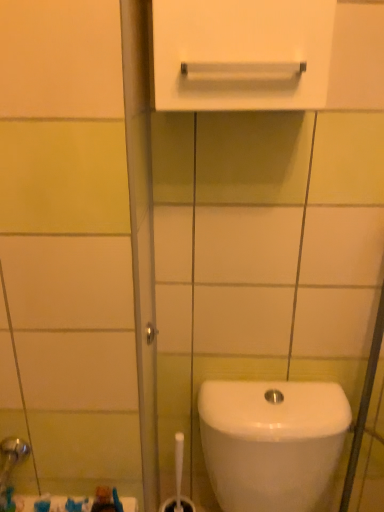
What do you see at coordinates (178, 482) in the screenshot? I see `white plastic brush at lower center` at bounding box center [178, 482].

Image resolution: width=384 pixels, height=512 pixels. I want to click on white glossy towel bar at upper center, so click(x=241, y=54).

Does point (322, 414) come behind point (293, 85)?

Yes.

Is white glossy toilet at lower right inside the boundaries of white glossy towel bar at upper center, or outside?

The correct answer is: outside.

From the image's perspective, does white glossy toilet at lower right appear higher than white glossy towel bar at upper center?

Actually, white glossy toilet at lower right appears below white glossy towel bar at upper center in the image.

Is white glossy toilet at lower right wider than white glossy towel bar at upper center?

Yes.

From the picture: From the image's perspective, is white glossy toilet at lower right under white plastic brush at lower center?

No, from the image's perspective, white glossy toilet at lower right is not beneath white plastic brush at lower center.

Between point (217, 420) and point (174, 499), which one is positioned behind?

The point (174, 499) is farther from the camera.

From the picture: Can you confirm if white glossy toilet at lower right is positioned to the right of white plastic brush at lower center?

Correct, you'll find white glossy toilet at lower right to the right of white plastic brush at lower center.

From a real-world perspective, which is physically below, white glossy toilet at lower right or white plastic brush at lower center?

white plastic brush at lower center.

How many degrees apart are the facing directions of white glossy towel bar at upper center and white glossy toilet at lower right?

They differ by 1.14 degrees in their facing directions.

From the image's perspective, which is below, white glossy towel bar at upper center or white glossy toilet at lower right?

white glossy toilet at lower right is shown below in the image.

Which object is thinner, white glossy towel bar at upper center or white glossy toilet at lower right?

With smaller width is white glossy towel bar at upper center.

Could you tell me if white plastic brush at lower center is turned towards white glossy toilet at lower right?

No.

Is white plastic brush at lower center shorter than white glossy toilet at lower right?

Yes.

Can you tell me how much white plastic brush at lower center and white glossy toilet at lower right differ in facing direction?

5.79e-06 degrees.

Which point is more distant from viewer, (168, 502) or (326, 387)?

Point (168, 502)

How different are the orientations of white plastic brush at lower center and white glossy towel bar at upper center in degrees?

1.14 degrees separate the facing orientations of white plastic brush at lower center and white glossy towel bar at upper center.

Does point (164, 511) lie behind point (217, 69)?

Yes.

Does white plastic brush at lower center have a greater width compared to white glossy towel bar at upper center?

No, white plastic brush at lower center is not wider than white glossy towel bar at upper center.

This screenshot has width=384, height=512. What are the coordinates of `medicine cabinet above the white plastic brush at lower center (from a real-world perspective)` in the screenshot? It's located at (241, 54).

Could you tell me if white glossy towel bar at upper center is turned towards white plastic brush at lower center?

No, white glossy towel bar at upper center is not turned towards white plastic brush at lower center.

From the image's perspective, between white glossy towel bar at upper center and white plastic brush at lower center, which one is located above?

white glossy towel bar at upper center.

Is point (224, 46) less distant than point (179, 434)?

Yes, point (224, 46) is closer to viewer.

From a real-world perspective, is white glossy towel bar at upper center on top of white plastic brush at lower center?

Yes, from a real-world perspective, white glossy towel bar at upper center is above white plastic brush at lower center.

Where is `toilet below the white glossy towel bar at upper center (from a real-world perspective)`? This screenshot has height=512, width=384. toilet below the white glossy towel bar at upper center (from a real-world perspective) is located at coordinates (271, 442).

Image resolution: width=384 pixels, height=512 pixels. Identify the location of toilet in front of the white plastic brush at lower center. (271, 442).

Based on their spatial positions, is white plastic brush at lower center or white glossy towel bar at upper center further from white glossy toilet at lower right?

white glossy towel bar at upper center is further to white glossy toilet at lower right.

When comparing their distances from white glossy towel bar at upper center, does white glossy toilet at lower right or white plastic brush at lower center seem further?

white plastic brush at lower center is further to white glossy towel bar at upper center.

Looking at the image, which one is located further to white glossy towel bar at upper center, white plastic brush at lower center or white glossy toilet at lower right?

The object further to white glossy towel bar at upper center is white plastic brush at lower center.

Estimate the real-world distances between objects in this image. Which object is further from white plastic brush at lower center, white glossy toilet at lower right or white glossy towel bar at upper center?

white glossy towel bar at upper center lies further to white plastic brush at lower center than the other object.

Looking at the image, which one is located closer to white plastic brush at lower center, white glossy towel bar at upper center or white glossy toilet at lower right?

white glossy toilet at lower right is closer to white plastic brush at lower center.

Looking at the image, which one is located further to white glossy toilet at lower right, white glossy towel bar at upper center or white plastic brush at lower center?

white glossy towel bar at upper center lies further to white glossy toilet at lower right than the other object.

Identify the location of toilet between white glossy towel bar at upper center and white plastic brush at lower center from top to bottom. The width and height of the screenshot is (384, 512). (271, 442).